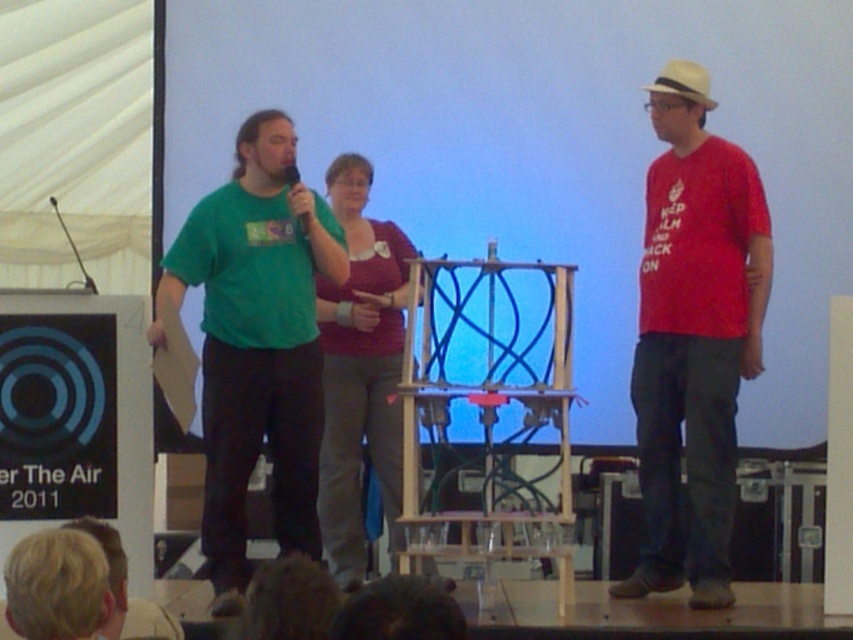
Between red matte shirt at center and green matte t-shirt at center, which one is positioned higher?

Positioned higher is green matte t-shirt at center.

How distant is red matte shirt at center from green matte t-shirt at center?

red matte shirt at center and green matte t-shirt at center are 5.68 feet apart.

Describe the element at coordinates (694, 346) in the screenshot. I see `red matte shirt at center` at that location.

Locate an element on the screen. The height and width of the screenshot is (640, 853). red matte shirt at center is located at coordinates (694, 346).

Which is above, red matte shirt at center or black matte microphone at upper center?

black matte microphone at upper center is higher up.

Can you confirm if red matte shirt at center is thinner than black matte microphone at upper center?

No, red matte shirt at center is not thinner than black matte microphone at upper center.

Describe the element at coordinates (694, 346) in the screenshot. The image size is (853, 640). I see `red matte shirt at center` at that location.

This screenshot has height=640, width=853. I want to click on red matte shirt at center, so click(694, 346).

Can you confirm if red matte shirt at center is bigger than blonde hair at lower left?

Correct, red matte shirt at center is larger in size than blonde hair at lower left.

Which is more to the left, red matte shirt at center or blonde hair at lower left?

Positioned to the left is blonde hair at lower left.

Where is `red matte shirt at center`? The height and width of the screenshot is (640, 853). red matte shirt at center is located at coordinates click(x=694, y=346).